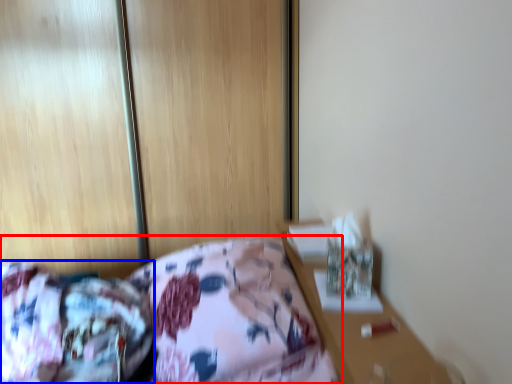
Question: Which object is further to the camera taking this photo, bed (highlighted by a red box) or mattress (highlighted by a blue box)?

Choices:
 (A) bed
 (B) mattress

Answer: (A)